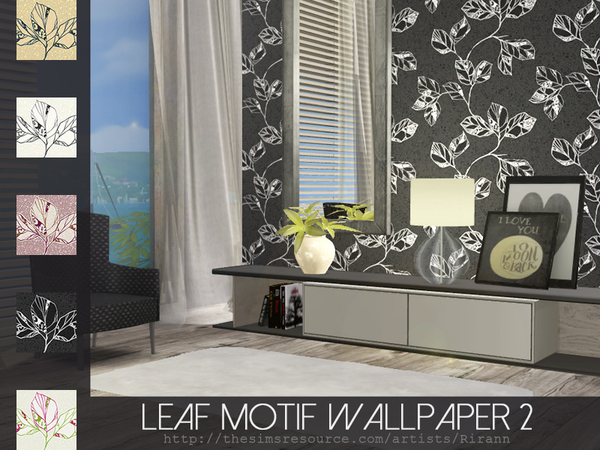
At what (x,y) coordinates should I click in order to perform the action: click on curtain. Please return your answer as a coordinate pair (x, y). Looking at the image, I should click on (196, 108), (375, 62).